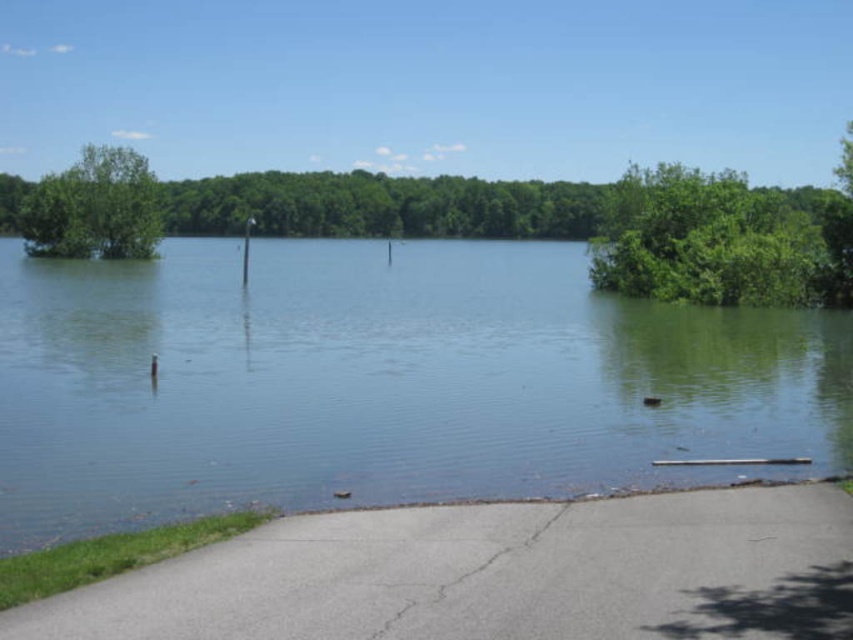
Question: Which object is closer to the camera taking this photo?

Choices:
 (A) green leafy tree at upper left
 (B) clear water at center
 (C) green leafy tree at upper right

Answer: (B)

Question: Does clear water at center have a larger size compared to green leafy tree at upper left?

Choices:
 (A) no
 (B) yes

Answer: (A)

Question: Is green leafy tree at upper right positioned at the back of green leafy tree at upper left?

Choices:
 (A) yes
 (B) no

Answer: (B)

Question: Is green leafy tree at upper right wider than green leafy tree at upper left?

Choices:
 (A) no
 (B) yes

Answer: (A)

Question: Which of the following is the closest to the observer?

Choices:
 (A) (244, 435)
 (B) (115, 196)
 (C) (599, 280)

Answer: (A)

Question: Considering the real-world distances, which object is closest to the clear water at center?

Choices:
 (A) green leafy tree at upper left
 (B) green leafy tree at upper right

Answer: (B)